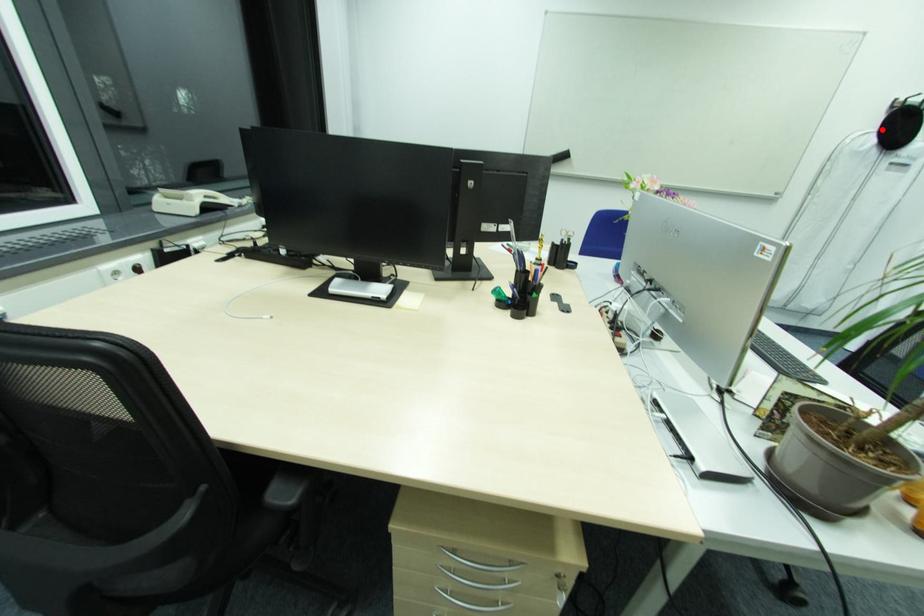
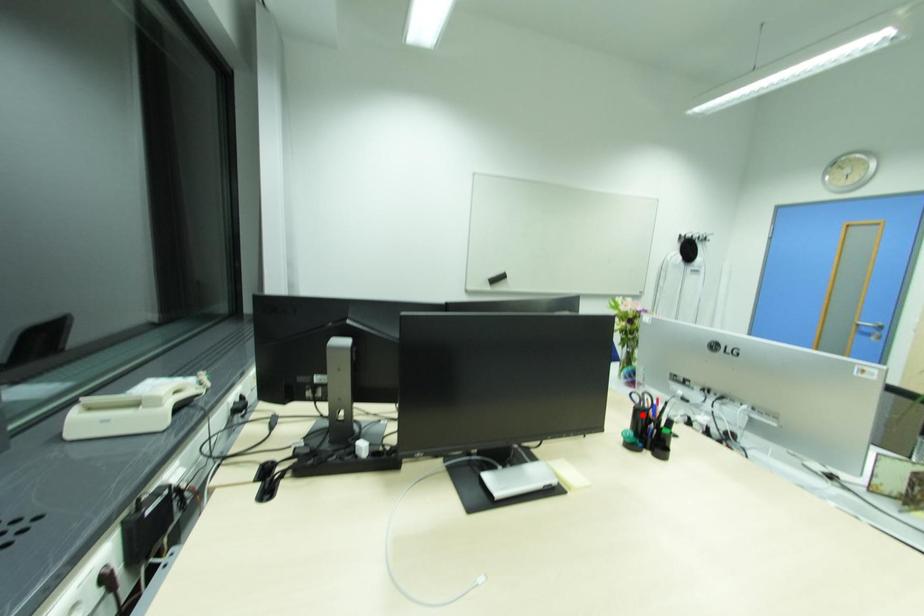
I am providing you with two images of the same scene from different viewpoints. A red point is marked on the first image and another point is marked on the second image. Does the point marked in image1 correspond to the same location as the one in image2?

No